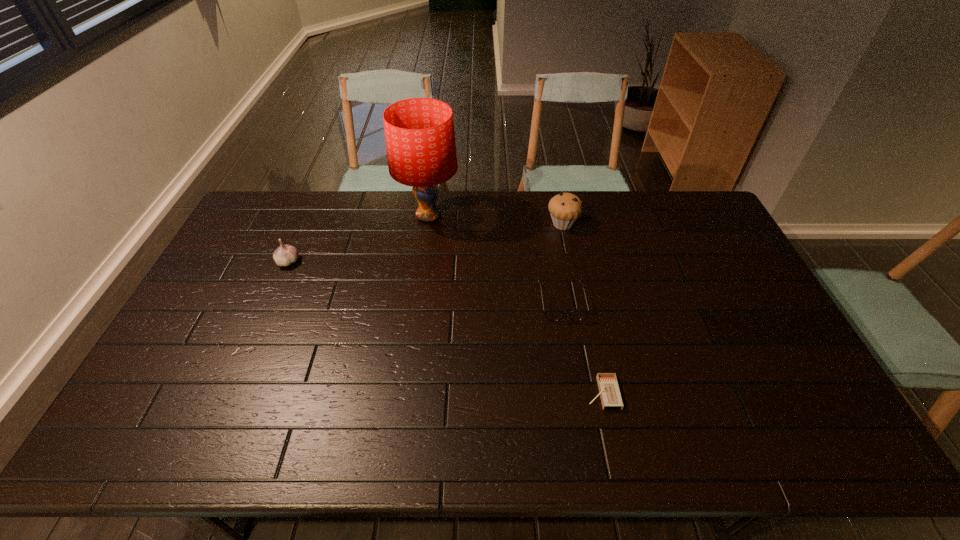
Locate an element on the screen. Image resolution: width=960 pixels, height=540 pixels. vacant space at the left edge of the desktop is located at coordinates (277, 234).

The width and height of the screenshot is (960, 540). I want to click on free region at the right edge, so click(x=796, y=381).

Where is `free location at the near left corner of the desktop`? free location at the near left corner of the desktop is located at coordinates pos(184,432).

Identify the location of free point at the far right corner. The height and width of the screenshot is (540, 960). (691, 214).

Locate an element on the screen. The width and height of the screenshot is (960, 540). blank space at the near right corner of the desktop is located at coordinates (817, 444).

Locate an element on the screen. vacant space in between the spectacles and the nearest object is located at coordinates (582, 348).

The width and height of the screenshot is (960, 540). In order to click on vacant space in between the fourth shortest object and the fourth farthest object in this screenshot , I will do `click(563, 263)`.

Where is `blank region between the third nearest object and the matchbox`? blank region between the third nearest object and the matchbox is located at coordinates (445, 327).

This screenshot has height=540, width=960. In order to click on free space between the leftmost object and the lampshade in this screenshot , I will do `click(359, 239)`.

Locate an element on the screen. Image resolution: width=960 pixels, height=540 pixels. empty space between the second object from left to right and the fourth tallest object is located at coordinates click(495, 259).